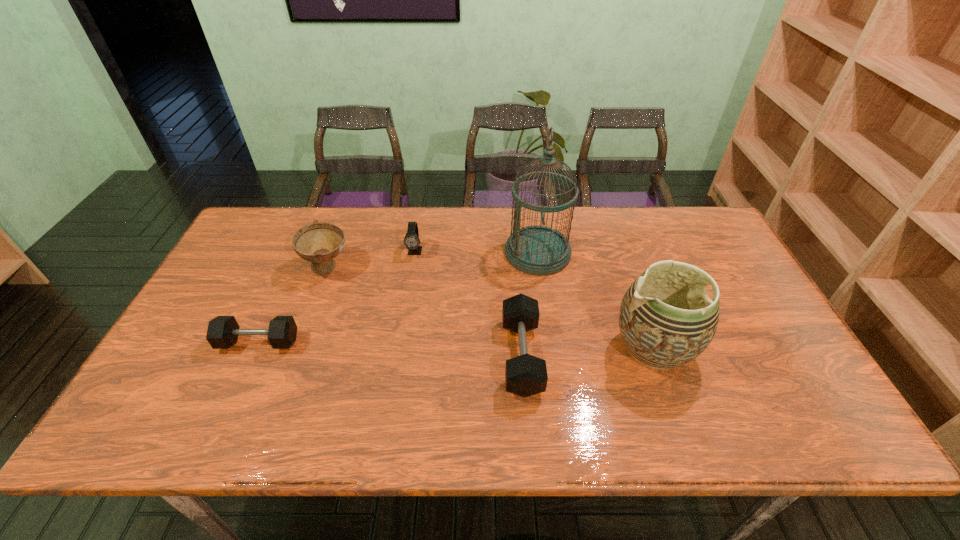
The image size is (960, 540). In order to click on free spot between the pottery and the third tallest object in this screenshot , I will do `click(491, 308)`.

You are a GUI agent. You are given a task and a screenshot of the screen. Output one action in this format:
    pyautogui.click(x=<x>, y=<y>)
    Task: Click on the free space between the fourth object from right to left and the birdcage
    
    Given the screenshot: What is the action you would take?
    pyautogui.click(x=476, y=252)

You are a GUI agent. You are given a task and a screenshot of the screen. Output one action in this format:
    pyautogui.click(x=<x>, y=<y>)
    Task: Click on the empty space that is in between the birdcage and the soup bowl
    The image size is (960, 540).
    Given the screenshot: What is the action you would take?
    pyautogui.click(x=433, y=260)

Identify the location of empty space between the fourth object from right to left and the third tallest object. (372, 259).

Where is `unoccupied area between the fourth shortest object and the shorter dumbbell`? This screenshot has height=540, width=960. unoccupied area between the fourth shortest object and the shorter dumbbell is located at coordinates (293, 305).

Locate an element on the screen. The height and width of the screenshot is (540, 960). vacant area between the tallest object and the shorter dumbbell is located at coordinates (398, 298).

Where is `empty space between the taller dumbbell and the fifth shortest object`? empty space between the taller dumbbell and the fifth shortest object is located at coordinates (588, 352).

I want to click on object that stands as the fourth closest to the soup bowl, so click(537, 250).

Identify the location of object that stands as the second closest to the rightmost object. The image size is (960, 540). point(525,375).

Identify the location of vacant point that satisfies the following two spatial constraints: 1. on the back side of the rightmost object; 2. on the front-facing side of the tallest object. (620, 253).